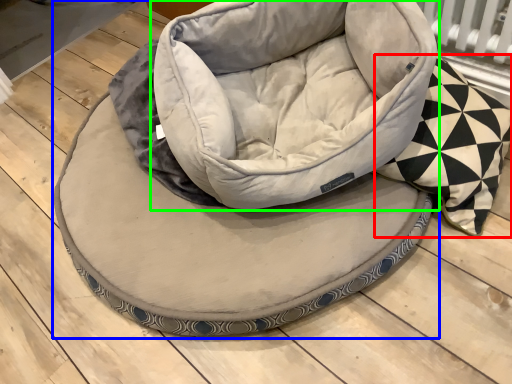
Question: Estimate the real-world distances between objects in this image. Which object is farther from throw pillow (highlighted by a red box), dog bed (highlighted by a blue box) or bean bag chair (highlighted by a green box)?

Choices:
 (A) dog bed
 (B) bean bag chair

Answer: (A)